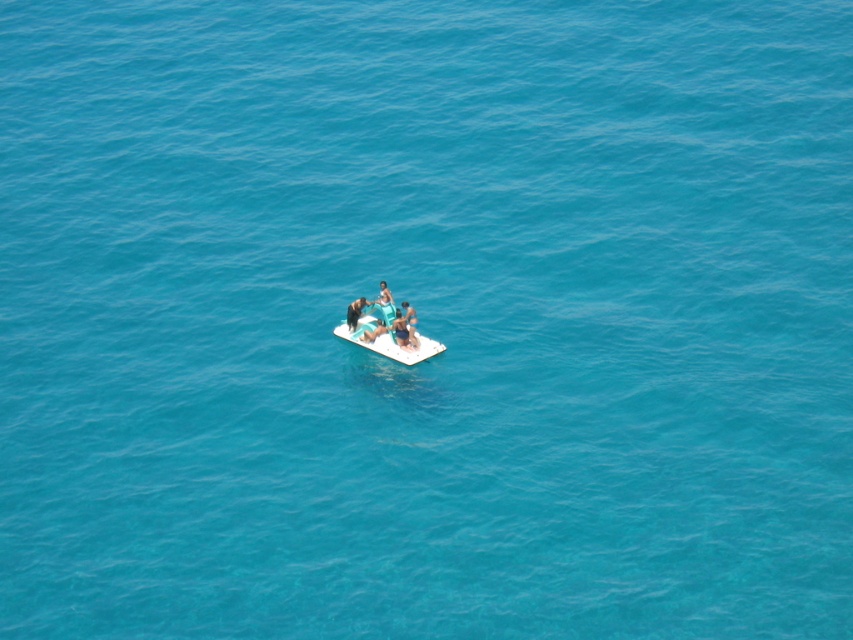
Does matte teal surfboard at center come behind smooth blue shorts at center?

That is False.

Does matte teal surfboard at center have a lesser width compared to smooth blue shorts at center?

In fact, matte teal surfboard at center might be wider than smooth blue shorts at center.

You are a GUI agent. You are given a task and a screenshot of the screen. Output one action in this format:
    pyautogui.click(x=<x>, y=<y>)
    Task: Click on the matte teal surfboard at center
    This screenshot has width=853, height=640.
    Given the screenshot: What is the action you would take?
    pyautogui.click(x=379, y=320)

Between matte teal surfboard at center and blue fabric person at center, which one appears on the left side from the viewer's perspective?

blue fabric person at center

Can you confirm if matte teal surfboard at center is thinner than blue fabric person at center?

No, matte teal surfboard at center is not thinner than blue fabric person at center.

Between point (369, 339) and point (386, 296), which one is positioned behind?

Point (386, 296)

Image resolution: width=853 pixels, height=640 pixels. I want to click on matte teal surfboard at center, so click(379, 320).

Is point (407, 358) positioned after point (357, 305)?

Yes, it is.

Find the location of a particular element. The height and width of the screenshot is (640, 853). white plastic raft at center is located at coordinates (386, 333).

This screenshot has height=640, width=853. Describe the element at coordinates (386, 333) in the screenshot. I see `white plastic raft at center` at that location.

Locate an element on the screen. The image size is (853, 640). white plastic raft at center is located at coordinates (386, 333).